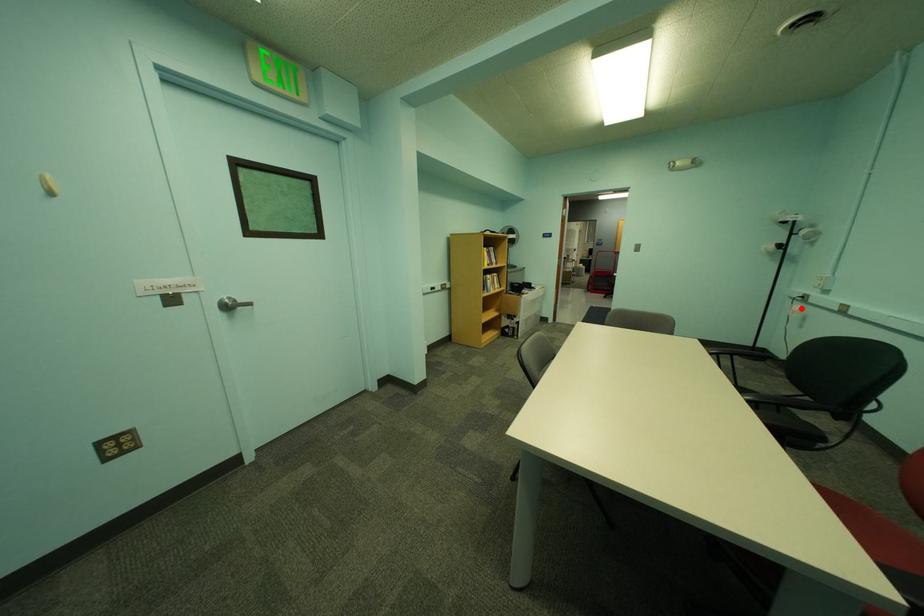
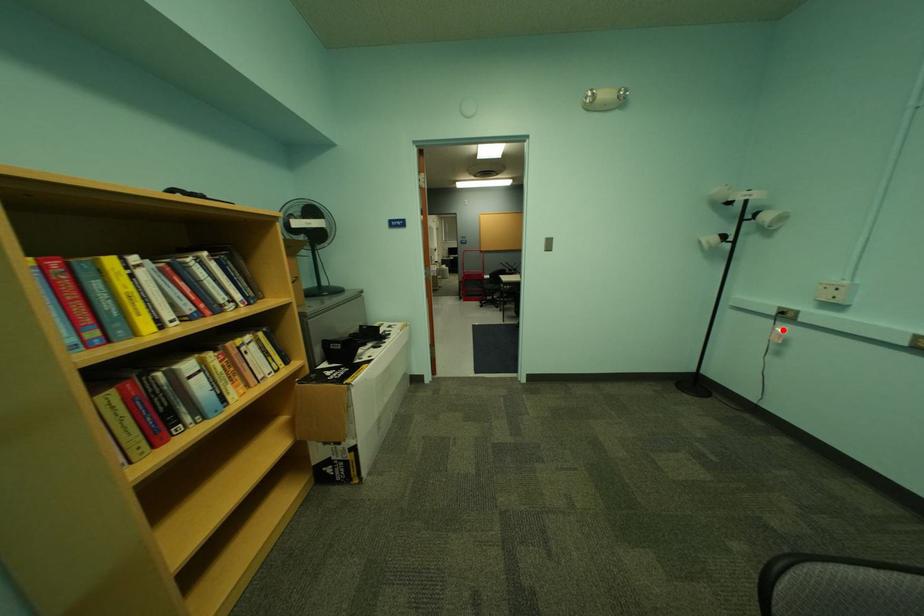
I am providing you with two images of the same scene from different viewpoints. A red point is marked on the first image and another point is marked on the second image. Is the marked point in image1 the same physical position as the marked point in image2?

Yes